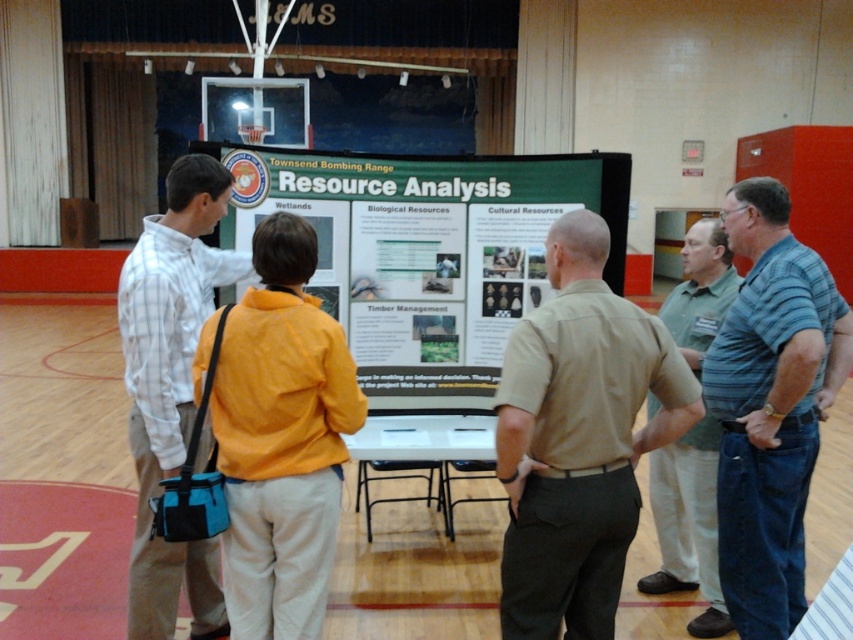
You are a photographer standing at the back of the gymnasium. You want to take a photo of the khaki pants at center and the khaki uniform shirt at center. If your camera has a minimum focus distance of 1.5 meters, will you be able to capture both items clearly in the same photo without moving closer?

The khaki pants at center is 1.49 meters from the khaki uniform shirt at center. Since the distance between them is less than the camera minimum focus distance of 1.5 meters, the camera can focus on both items simultaneously. Therefore, you can capture both items clearly in the same photo without moving closer.

From the picture: You are a photographer trying to capture a candid shot of the khaki pants at center and the khaki uniform shirt at center during the presentation. Since you want to focus on the lower body and upper body details respectively, which object should you adjust your camera focus to first based on their vertical positions?

The khaki pants at center is shorter than the khaki uniform shirt at center, so you should focus on the khaki uniform shirt at center first as it is taller and requires attention to upper body details.